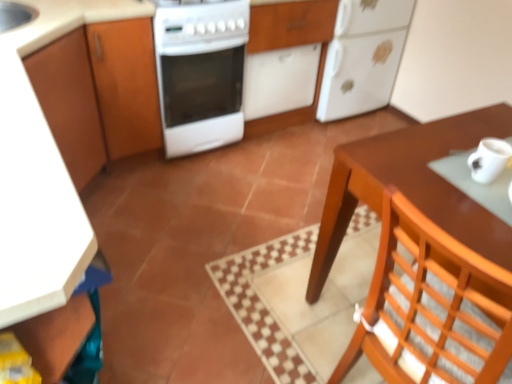
Identify the location of vacant location behind white matte mug at right. The height and width of the screenshot is (384, 512). (442, 137).